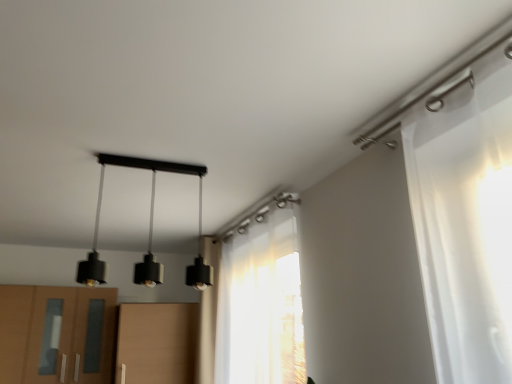
What do you see at coordinates (56, 334) in the screenshot?
I see `matte brown cabinet at lower left` at bounding box center [56, 334].

Describe the element at coordinates (256, 307) in the screenshot. The height and width of the screenshot is (384, 512). I see `translucent white curtain at center` at that location.

Where is `matte brown cabinet at lower left`? matte brown cabinet at lower left is located at coordinates (56, 334).

In terms of width, does matte brown cabinet at lower left look wider or thinner when compared to translucent white curtain at center?

matte brown cabinet at lower left is wider than translucent white curtain at center.

From the image's perspective, between matte brown cabinet at lower left and translucent white curtain at center, which one is located above?

translucent white curtain at center, from the image's perspective.

Where is `cabinetry that appears on the left of translucent white curtain at center`? The height and width of the screenshot is (384, 512). cabinetry that appears on the left of translucent white curtain at center is located at coordinates (56, 334).

Would you say matte brown cabinet at lower left is to the left or to the right of translucent white curtain at center in the picture?

matte brown cabinet at lower left is to the left of translucent white curtain at center.

This screenshot has height=384, width=512. In order to click on curtain lying behind the black matte pendant lights at center in this screenshot , I will do `click(256, 307)`.

Does point (154, 265) appear closer or farther from the camera than point (259, 365)?

Point (154, 265) is closer to the camera than point (259, 365).

In the scene shown: Is black matte pendant lights at center taller or shorter than translucent white curtain at center?

black matte pendant lights at center is shorter than translucent white curtain at center.

In the image, is translucent white curtain at center on the left side or the right side of black matte pendant lights at center?

Clearly, translucent white curtain at center is on the right of black matte pendant lights at center in the image.

Could you tell me if translucent white curtain at center is turned towards black matte pendant lights at center?

Yes, translucent white curtain at center is facing black matte pendant lights at center.

Is translucent white curtain at center not inside black matte pendant lights at center?

Indeed, translucent white curtain at center is completely outside black matte pendant lights at center.

Which of these two, translucent white curtain at center or black matte pendant lights at center, is wider?

With larger width is black matte pendant lights at center.

Is translucent white curtain at center thinner than matte brown cabinet at lower left?

Yes, translucent white curtain at center is thinner than matte brown cabinet at lower left.

Who is smaller, translucent white curtain at center or matte brown cabinet at lower left?

With smaller size is matte brown cabinet at lower left.

Is point (204, 329) positioned in front of point (33, 305)?

No.

Which object is more forward, translucent white curtain at center or matte brown cabinet at lower left?

translucent white curtain at center.

Based on the photo, can you see matte brown cabinet at lower left touching black matte pendant lights at center?

There is a gap between matte brown cabinet at lower left and black matte pendant lights at center.

Which object is more forward, matte brown cabinet at lower left or black matte pendant lights at center?

Positioned in front is black matte pendant lights at center.

Which is less distant, (8, 292) or (122, 164)?

Point (8, 292) appears to be farther away from the viewer than point (122, 164).

Which of these two, matte brown cabinet at lower left or black matte pendant lights at center, is smaller?

black matte pendant lights at center is smaller.

Is black matte pendant lights at center situated inside matte brown cabinet at lower left or outside?

black matte pendant lights at center is not enclosed by matte brown cabinet at lower left.

Which is more distant, (94, 268) or (46, 312)?

The point (46, 312) is behind.

Based on the photo, considering the sizes of objects black matte pendant lights at center and matte brown cabinet at lower left in the image provided, who is wider, black matte pendant lights at center or matte brown cabinet at lower left?

black matte pendant lights at center is wider.

Locate an element on the screen. cabinetry behind the translucent white curtain at center is located at coordinates (56, 334).

Where is `curtain below the black matte pendant lights at center (from a real-world perspective)`? This screenshot has height=384, width=512. curtain below the black matte pendant lights at center (from a real-world perspective) is located at coordinates (256, 307).

Estimate the real-world distances between objects in this image. Which object is closer to translucent white curtain at center, black matte pendant lights at center or matte brown cabinet at lower left?

black matte pendant lights at center is closer to translucent white curtain at center.

From the image, which object appears to be farther from black matte pendant lights at center, matte brown cabinet at lower left or translucent white curtain at center?

Among the two, translucent white curtain at center is located further to black matte pendant lights at center.

From the image, which object appears to be nearer to translucent white curtain at center, matte brown cabinet at lower left or black matte pendant lights at center?

Based on the image, black matte pendant lights at center appears to be nearer to translucent white curtain at center.

Considering their positions, is black matte pendant lights at center positioned closer to matte brown cabinet at lower left than translucent white curtain at center?

black matte pendant lights at center lies closer to matte brown cabinet at lower left than the other object.

Looking at the image, which one is located further to matte brown cabinet at lower left, translucent white curtain at center or black matte pendant lights at center?

The object further to matte brown cabinet at lower left is translucent white curtain at center.

Considering their positions, is translucent white curtain at center positioned closer to black matte pendant lights at center than matte brown cabinet at lower left?

Based on the image, matte brown cabinet at lower left appears to be nearer to black matte pendant lights at center.

Locate an element on the screen. The width and height of the screenshot is (512, 384). lamp situated between matte brown cabinet at lower left and translucent white curtain at center from left to right is located at coordinates (149, 228).